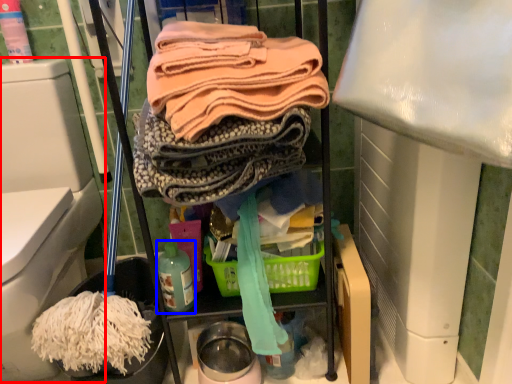
Question: Which object is closer to the camera taking this photo, bidet (highlighted by a red box) or bottle (highlighted by a blue box)?

Choices:
 (A) bidet
 (B) bottle

Answer: (A)